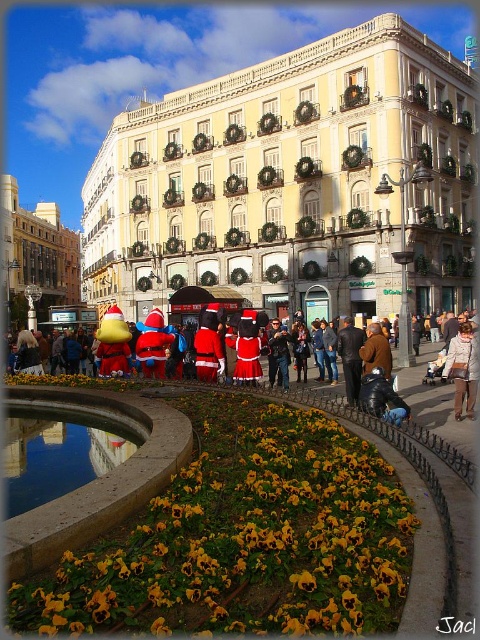
Is dark blue leather jacket at lower center positioned before brown leather jacket at center?

Yes.

Who is taller, dark blue leather jacket at lower center or brown leather jacket at center?

brown leather jacket at center is taller.

Is point (406, 403) less distant than point (380, 349)?

That is True.

You are a GUI agent. You are given a task and a screenshot of the screen. Output one action in this format:
    pyautogui.click(x=<x>, y=<y>)
    Task: Click on the dark blue leather jacket at lower center
    The image size is (480, 640).
    Given the screenshot: What is the action you would take?
    pyautogui.click(x=382, y=397)

Is yellow matte flower at lower center to the right of dark blue leather jacket at lower center from the viewer's perspective?

No, yellow matte flower at lower center is not to the right of dark blue leather jacket at lower center.

Describe the element at coordinates (244, 538) in the screenshot. I see `yellow matte flower at lower center` at that location.

Find the location of `yellow matte flower at lower center`. yellow matte flower at lower center is located at coordinates (244, 538).

Who is taller, santa costume at center or light brown leather jacket at lower right?

Standing taller between the two is santa costume at center.

Who is lower down, santa costume at center or light brown leather jacket at lower right?

light brown leather jacket at lower right is below.

The image size is (480, 640). What are the coordinates of `santa costume at center` in the screenshot? It's located at (470, 372).